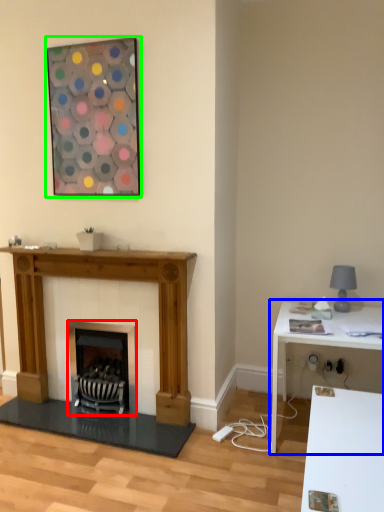
Question: Based on their relative distances, which object is farther from wood burning stove (highlighted by a red box)? Choose from table (highlighted by a blue box) and picture frame (highlighted by a green box).

Choices:
 (A) table
 (B) picture frame

Answer: (B)